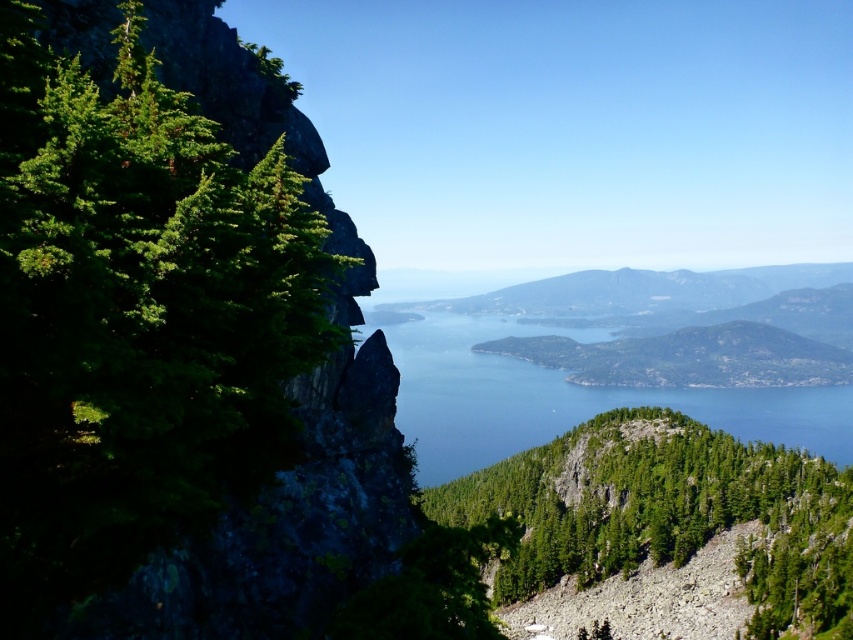
Who is higher up, green rough textured tree at center or blue water at center?

green rough textured tree at center is above.

Measure the distance between green rough textured tree at center and camera.

The distance of green rough textured tree at center from camera is 100.91 feet.

Is point (688, 458) farther from viewer compared to point (764, 387)?

No.

Identify the location of green rough textured tree at center. (639, 497).